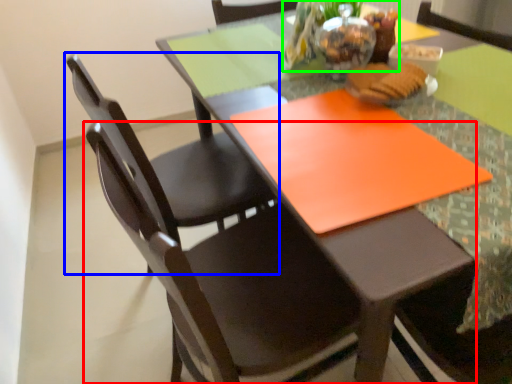
Question: Based on their relative distances, which object is nearer to chair (highlighted by a red box)? Choose from chair (highlighted by a blue box) and floral arrangement (highlighted by a green box).

Choices:
 (A) chair
 (B) floral arrangement

Answer: (A)